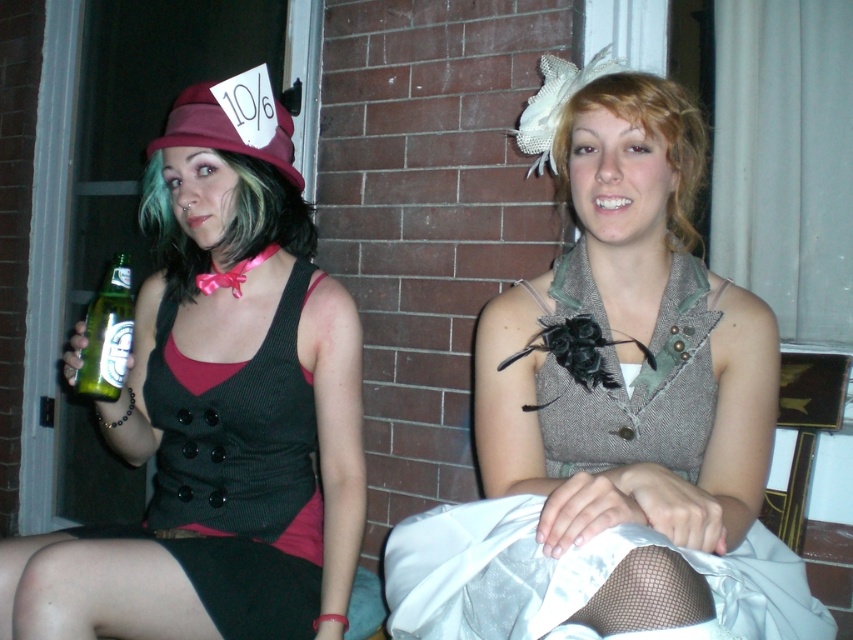
Question: Which point appears farthest from the camera in this image?

Choices:
 (A) (45, 621)
 (B) (161, 136)
 (C) (113, 276)
 (D) (720, 304)

Answer: (B)

Question: Which object is closer to the camera taking this photo?

Choices:
 (A) textured gray vest at center
 (B) matte burgundy fabric hat at upper left
 (C) matte black vest at center
 (D) green glass bottle at lower left

Answer: (A)

Question: Among these objects, which one is farthest from the camera?

Choices:
 (A) matte black vest at center
 (B) textured gray vest at center
 (C) matte burgundy fabric hat at upper left
 (D) green glass bottle at lower left

Answer: (C)

Question: Is matte black vest at center thinner than matte burgundy fabric hat at upper left?

Choices:
 (A) no
 (B) yes

Answer: (A)

Question: Is textured gray vest at center to the right of matte burgundy fabric hat at upper left from the viewer's perspective?

Choices:
 (A) no
 (B) yes

Answer: (B)

Question: Does matte black vest at center lie behind matte burgundy fabric hat at upper left?

Choices:
 (A) yes
 (B) no

Answer: (B)